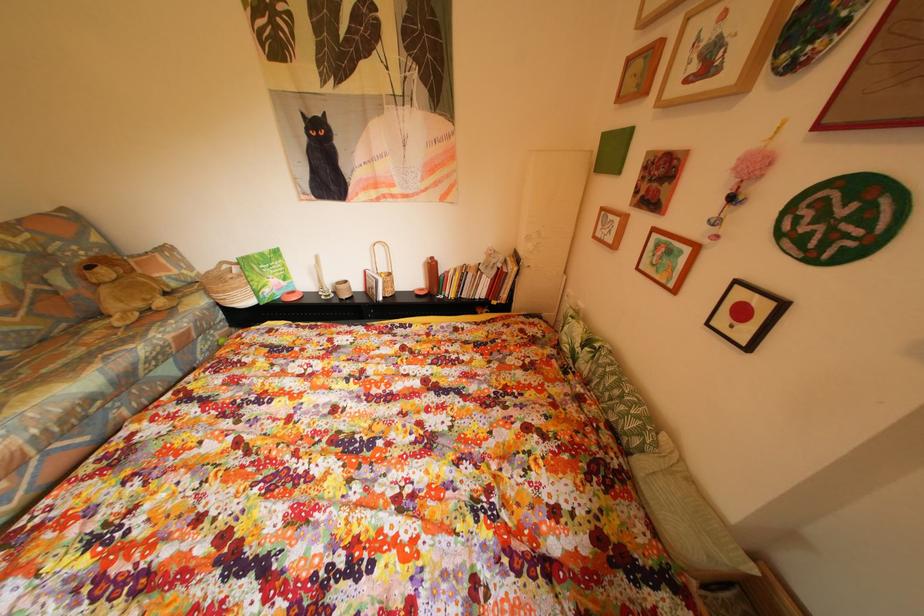
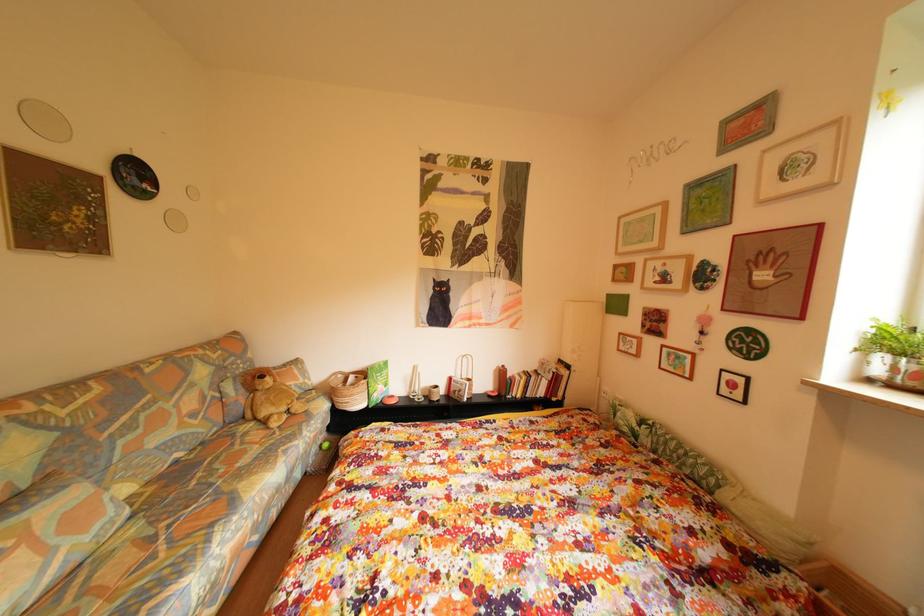
From the picture: In a continuous first-person perspective shot, in which direction is the camera moving?

The movement direction of the cameraman is left, backward.